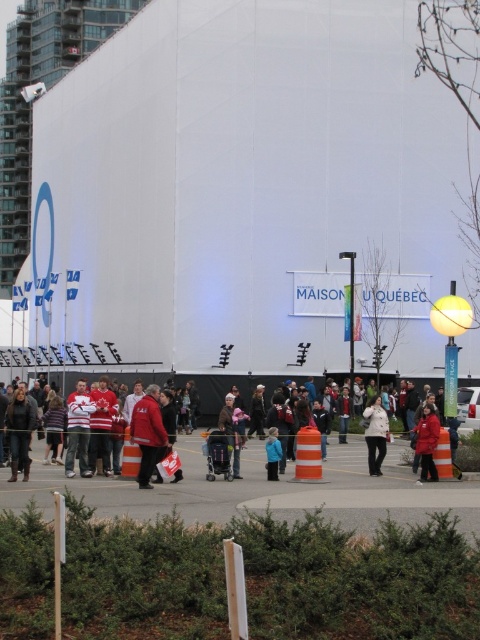
Consider the image. You are standing at the point labeled point (225, 384). There is a large white structure with a blue logo on its left side and text reading

The distance between you and the large white structure with a blue logo on its left side and text reading

You are a photographer standing at the edge of the crowd trying to capture a photo that includes both the red fleece jacket at center and the blue matte jacket at center. What is the minimum distance you need to move backward to ensure both jackets are in frame?

The red fleece jacket at center is 2.29 meters away from the blue matte jacket at center. To include both in the frame, you need to move back at least 2.29 meters so that the distance between them fits within your camera lens view.

You are organizing a group photo and need to arrange two jackets on a mannequin stand. The stand has a limited width. Given that the red fleece jacket at center and the blue matte jacket at center are both available, which jacket would you choose to ensure it fits on the stand if the stand can only accommodate the narrower of the two jackets?

You should choose the blue matte jacket at center because the red fleece jacket at center might be wider than the blue matte jacket at center, making the blue matte jacket the narrower option and more likely to fit on the stand.